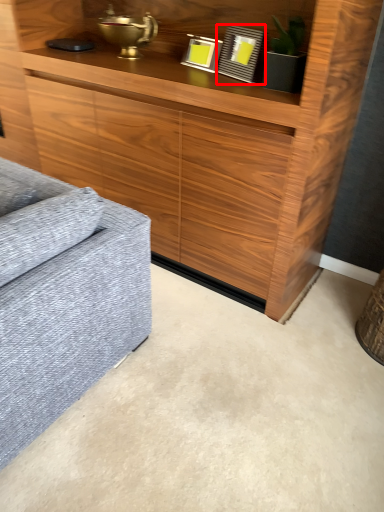
Question: In this image, where is picture frame (annotated by the red box) located relative to picture frame?

Choices:
 (A) left
 (B) right

Answer: (B)